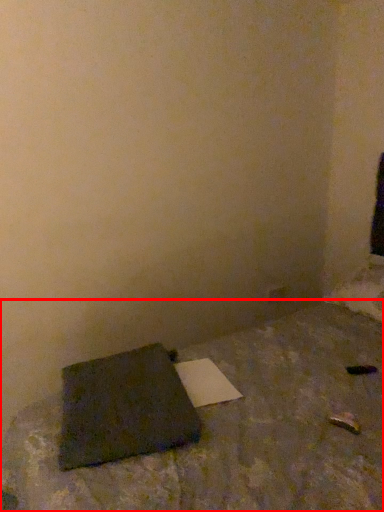
Question: Considering the relative positions of furniture (annotated by the red box) and notebook in the image provided, where is furniture (annotated by the red box) located with respect to the staircase?

Choices:
 (A) right
 (B) left

Answer: (A)